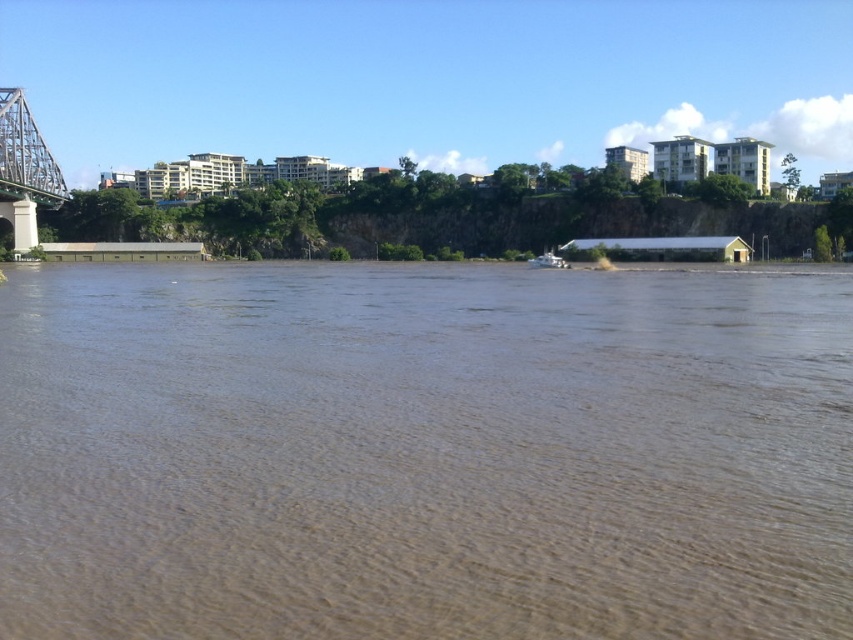
Question: Which point is closer to the camera?

Choices:
 (A) brown muddy water at center
 (B) metallic steel bridge at left

Answer: (A)

Question: Can you confirm if brown muddy water at center is positioned to the left of metallic steel bridge at left?

Choices:
 (A) no
 (B) yes

Answer: (A)

Question: Is brown muddy water at center further to camera compared to metallic steel bridge at left?

Choices:
 (A) no
 (B) yes

Answer: (A)

Question: Does brown muddy water at center have a larger size compared to metallic steel bridge at left?

Choices:
 (A) no
 (B) yes

Answer: (A)

Question: Which point is closer to the camera taking this photo?

Choices:
 (A) (119, 620)
 (B) (57, 173)

Answer: (A)